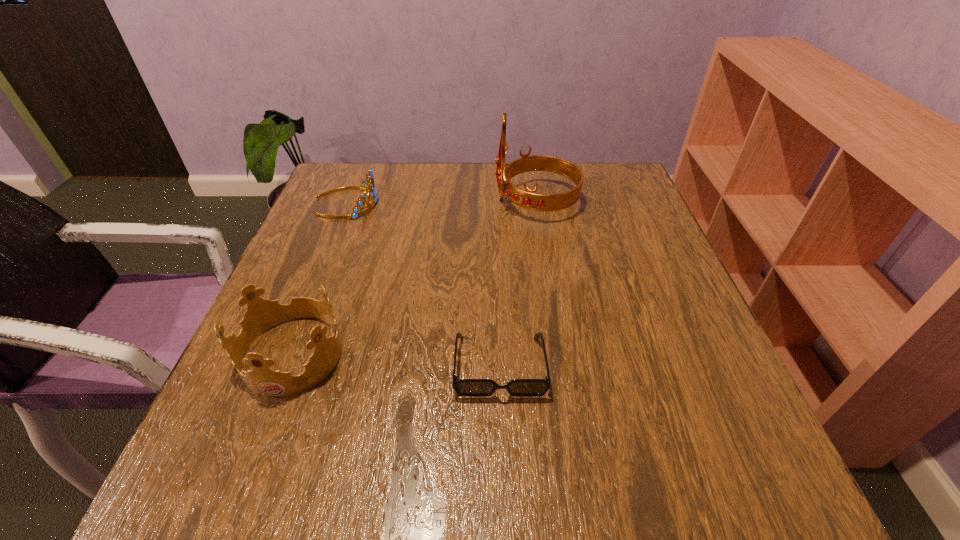
Identify the location of the tallest tiara. (528, 199).

This screenshot has width=960, height=540. I want to click on the rightmost tiara, so click(x=528, y=199).

This screenshot has width=960, height=540. I want to click on the nearest tiara, so click(x=261, y=314).

At what (x,y) coordinates should I click in order to perform the action: click on the third tallest object. Please return your answer as a coordinate pair (x, y). This screenshot has height=540, width=960. Looking at the image, I should click on (368, 185).

Locate an element on the screen. the shortest object is located at coordinates (463, 387).

The width and height of the screenshot is (960, 540). I want to click on vacant space located 0.280m on the front-facing side of the tallest object, so click(382, 201).

At what (x,y) coordinates should I click in order to perform the action: click on vacant region located 0.150m on the front-facing side of the tallest object. Please return your answer as a coordinate pair (x, y). Looking at the image, I should click on (434, 201).

The width and height of the screenshot is (960, 540). I want to click on vacant space located on the front-facing side of the tallest object, so click(x=382, y=201).

At what (x,y) coordinates should I click in order to perform the action: click on free space located on the front-facing side of the second shortest object. Please return your answer as a coordinate pair (x, y). Looking at the image, I should click on (402, 202).

Locate an element on the screen. This screenshot has height=540, width=960. vacant space positioned on the front-facing side of the shortest object is located at coordinates (504, 478).